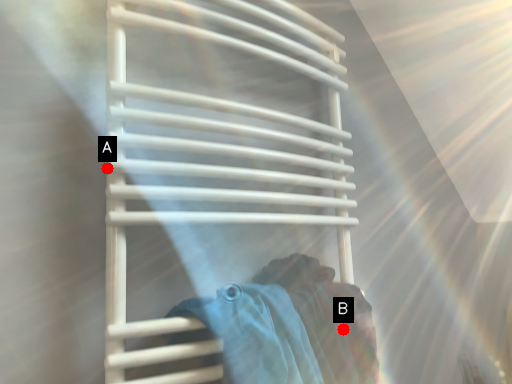
Question: Two points are circled on the image, labeled by A and B beside each circle. Which of the following is the closest to the observer?

Choices:
 (A) A is closer
 (B) B is closer

Answer: (A)